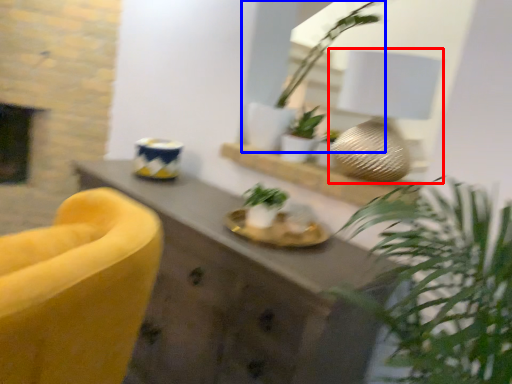
Question: Which object is further to the camera taking this photo, table lamp (highlighted by a red box) or houseplant (highlighted by a blue box)?

Choices:
 (A) table lamp
 (B) houseplant

Answer: (B)